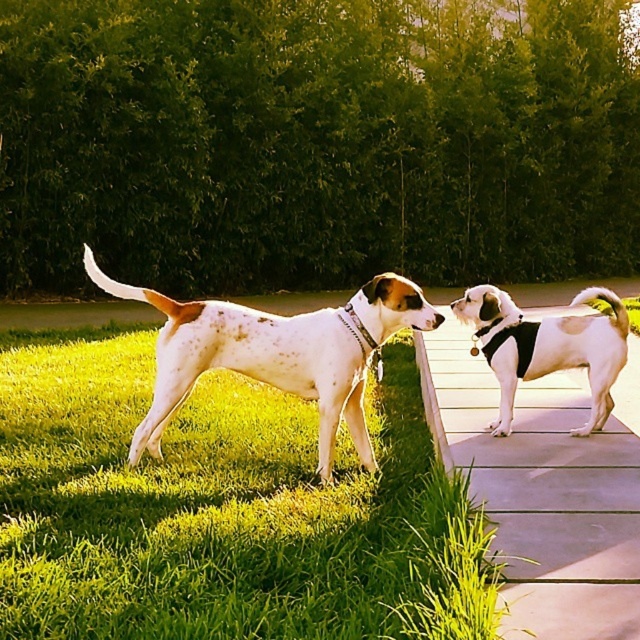
Between point (90, 340) and point (554, 348), which one is positioned in front?

Point (554, 348) is more forward.

Does green grass at lower left appear on the right side of white speckled fur at right?

In fact, green grass at lower left is to the left of white speckled fur at right.

Where is `green grass at lower left`? This screenshot has height=640, width=640. green grass at lower left is located at coordinates (224, 509).

Is concrete paving at center bigger than white speckled fur at right?

Correct, concrete paving at center is larger in size than white speckled fur at right.

Can you confirm if concrete paving at center is positioned below white speckled fur at right?

Yes.

Is point (577, 611) positioned behind point (512, 390)?

No, it is in front of (512, 390).

The width and height of the screenshot is (640, 640). In order to click on concrete paving at center in this screenshot , I will do pyautogui.click(x=541, y=492).

Which of these two, concrete paving at center or speckled white dog at center, stands taller?

speckled white dog at center is taller.

What are the coordinates of `concrete paving at center` in the screenshot? It's located at (541, 492).

Identify the location of concrete paving at center. (541, 492).